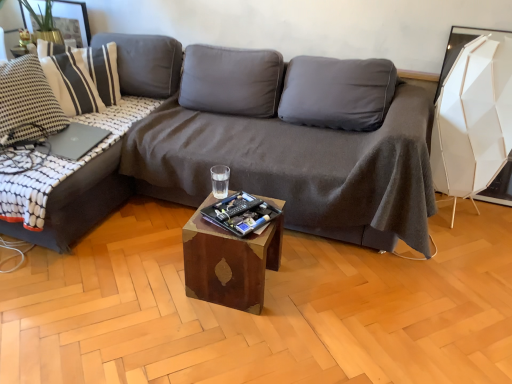
Image resolution: width=512 pixels, height=384 pixels. Identify the location of vacant area that is in front of wooden cube at center. (228, 338).